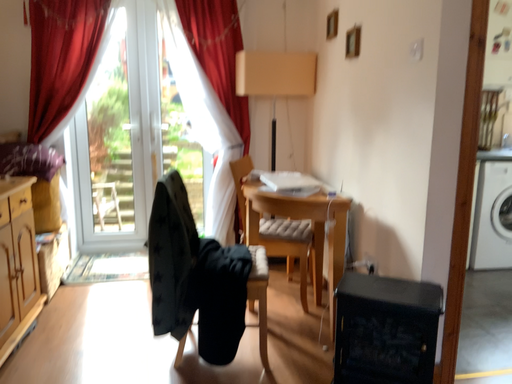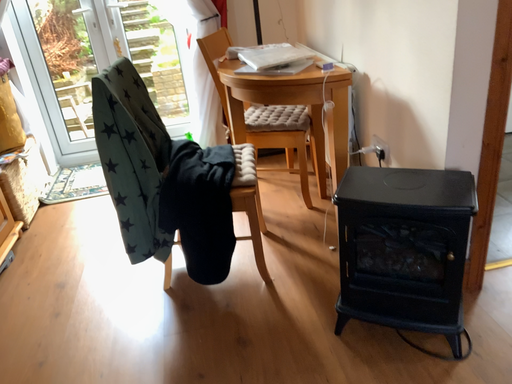
Question: How did the camera likely rotate when shooting the video?

Choices:
 (A) rotated downward
 (B) rotated upward

Answer: (A)